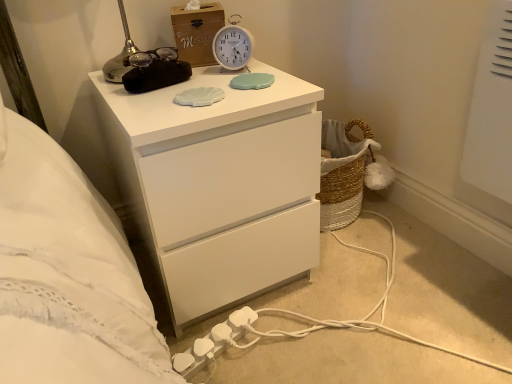
Question: From a real-world perspective, is white matte chest of drawers at upper center above or below white plastic extension cord at lower center?

Choices:
 (A) below
 (B) above

Answer: (B)

Question: Is white matte chest of drawers at upper center in front of or behind white plastic extension cord at lower center in the image?

Choices:
 (A) behind
 (B) front

Answer: (B)

Question: Based on their relative distances, which object is nearer to the white plastic power strip at lower center?

Choices:
 (A) white plastic extension cord at lower center
 (B) white matte chest of drawers at upper center
 (C) woodenmaterial/texturebox at upper center
 (D) white plastic alarm clock at upper center

Answer: (A)

Question: Which object is the closest to the white plastic extension cord at lower center?

Choices:
 (A) white plastic alarm clock at upper center
 (B) white plastic power strip at lower center
 (C) white matte chest of drawers at upper center
 (D) woodenmaterial/texturebox at upper center

Answer: (B)